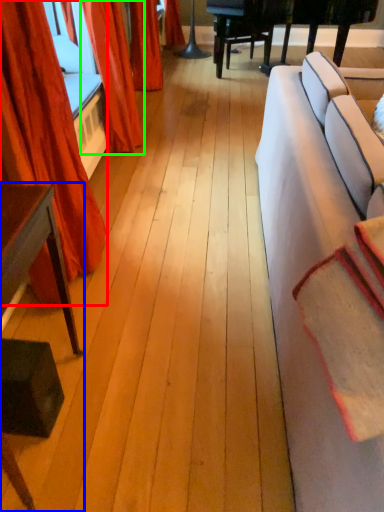
Question: Considering the real-world distances, which object is closest to curtain (highlighted by a red box)? table (highlighted by a blue box) or curtain (highlighted by a green box).

Choices:
 (A) table
 (B) curtain

Answer: (A)